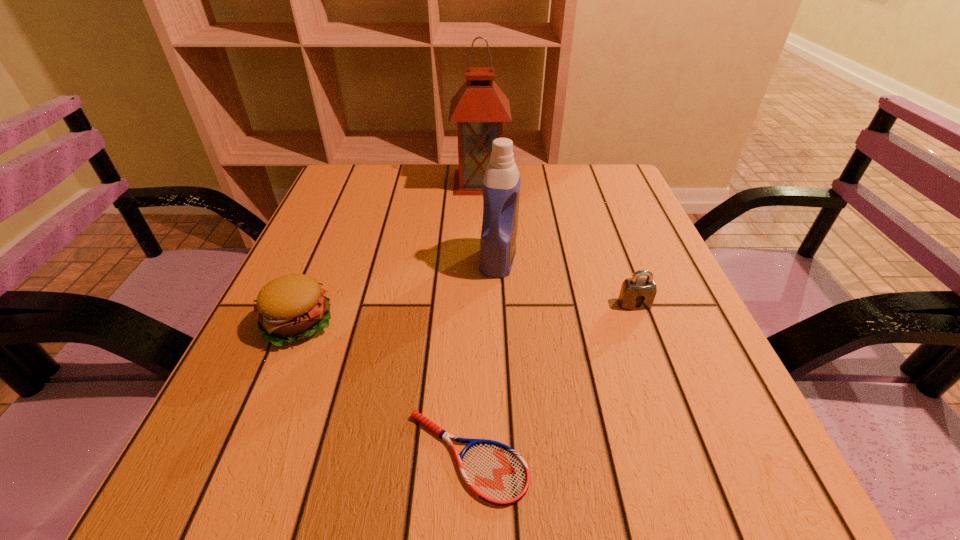
Find the location of a particular element. the farthest object is located at coordinates 479,107.

At what (x,y) coordinates should I click in order to perform the action: click on the tallest object. Please return your answer as a coordinate pair (x, y). This screenshot has height=540, width=960. Looking at the image, I should click on (479, 107).

The image size is (960, 540). Identify the location of the second farthest object. (501, 185).

Where is `detergent`? This screenshot has height=540, width=960. detergent is located at coordinates (501, 185).

The width and height of the screenshot is (960, 540). Find the location of `hamburger`. hamburger is located at coordinates (292, 307).

Find the location of a particular element. This screenshot has height=540, width=960. padlock is located at coordinates (643, 290).

This screenshot has height=540, width=960. Identify the location of tennis racket. (496, 473).

Locate an element on the screen. The width and height of the screenshot is (960, 540). the nearest object is located at coordinates (496, 473).

This screenshot has width=960, height=540. Identify the location of vacant space located 0.140m on the right of the tallest object. (560, 182).

The height and width of the screenshot is (540, 960). I want to click on free location located 0.140m on the right of the second farthest object, so click(x=584, y=259).